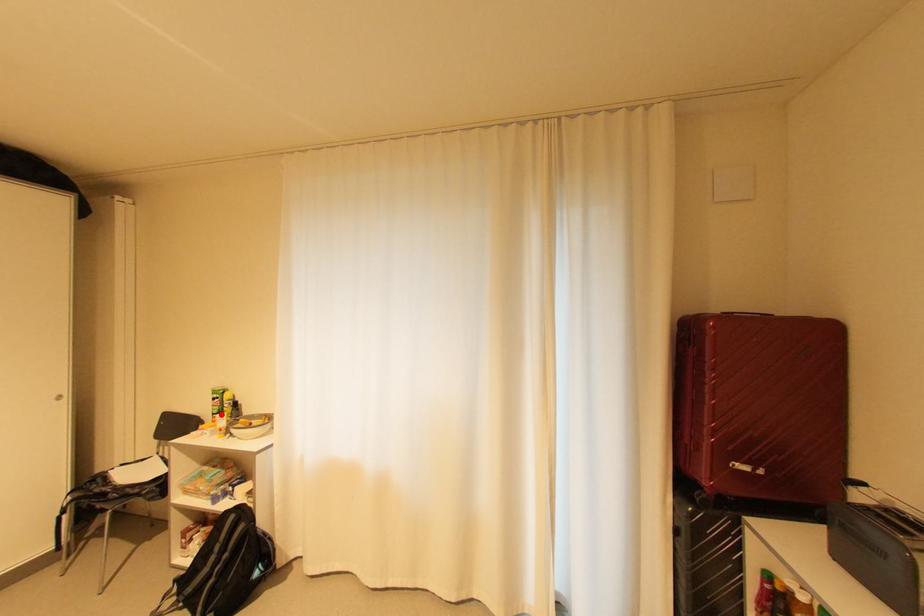
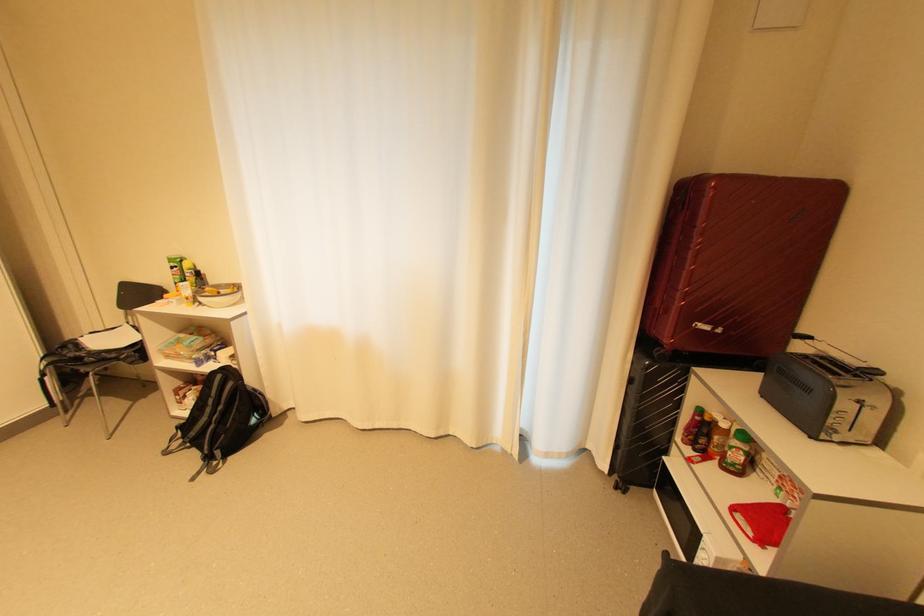
Question: I am providing you with two images of the same scene from different viewpoints. A red point is marked on the first image. Can you still see the location of the red point in image 2?

Choices:
 (A) Yes
 (B) No

Answer: (A)